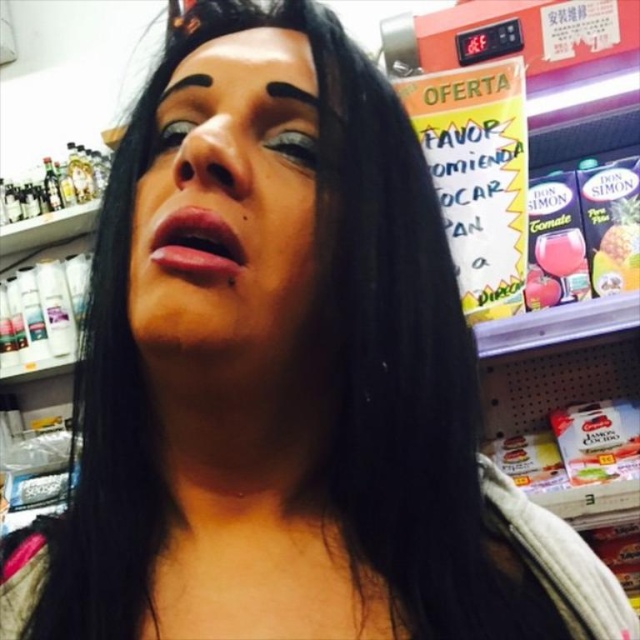
Can you confirm if black matte eyebrow at upper center is shorter than black matte eyebrow at upper left?

No.

Does point (291, 92) come behind point (161, 93)?

No, (291, 92) is closer to viewer.

Who is more distant from viewer, (x=342, y=109) or (x=168, y=84)?

The point (x=168, y=84) is more distant.

The image size is (640, 640). Find the location of `black matte eyebrow at upper center`. black matte eyebrow at upper center is located at coordinates (308, 99).

Does smooth skin face at center appear on the right side of black matte eyebrow at upper left?

Indeed, smooth skin face at center is positioned on the right side of black matte eyebrow at upper left.

Is smooth skin face at center below black matte eyebrow at upper left?

Yes, smooth skin face at center is below black matte eyebrow at upper left.

Describe the element at coordinates (228, 211) in the screenshot. I see `smooth skin face at center` at that location.

The height and width of the screenshot is (640, 640). In order to click on smooth skin face at center in this screenshot , I will do `click(228, 211)`.

Between matte black eye at upper center and black matte eyebrow at upper left, which one appears on the left side from the viewer's perspective?

From the viewer's perspective, black matte eyebrow at upper left appears more on the left side.

Between matte black eye at upper center and black matte eyebrow at upper left, which one has more height?

matte black eye at upper center

This screenshot has width=640, height=640. Describe the element at coordinates (294, 147) in the screenshot. I see `matte black eye at upper center` at that location.

At what (x,y) coordinates should I click in order to perform the action: click on matte black eye at upper center. Please return your answer as a coordinate pair (x, y). The width and height of the screenshot is (640, 640). Looking at the image, I should click on (294, 147).